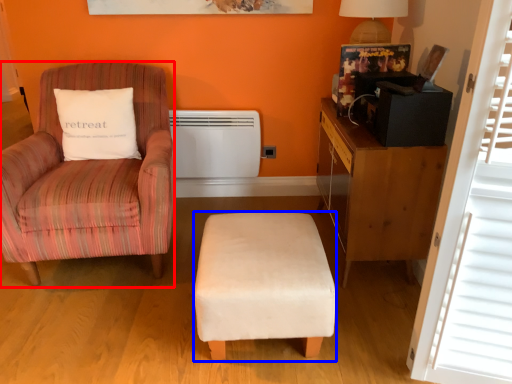
Question: Which object is closer to the camera taking this photo, chair (highlighted by a red box) or stool (highlighted by a blue box)?

Choices:
 (A) chair
 (B) stool

Answer: (B)